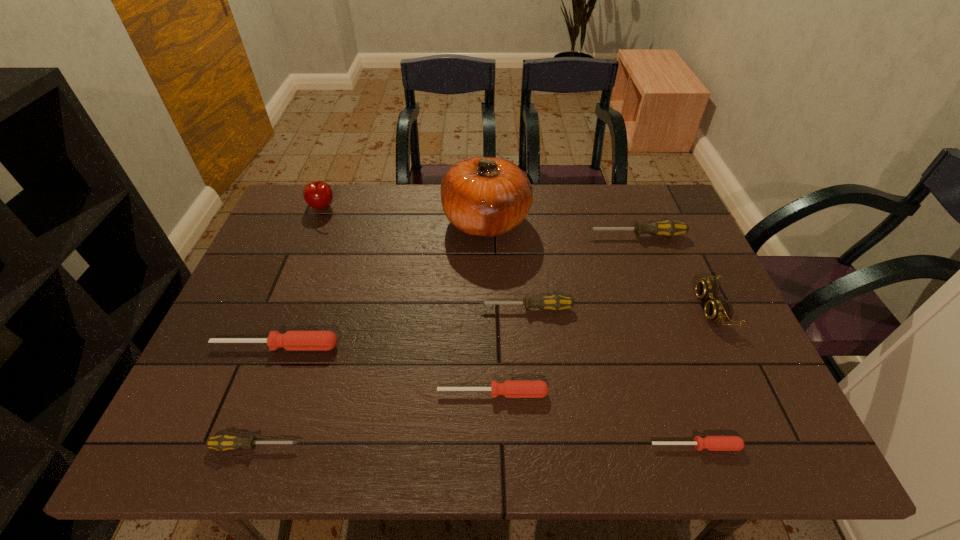
Image resolution: width=960 pixels, height=540 pixels. In order to click on free space that is in between the fourth nearest screwdriver and the smallest gray screwdriver in this screenshot , I will do `click(266, 396)`.

The height and width of the screenshot is (540, 960). What are the coordinates of `vacant area that lies between the second tallest object and the orange pumpkin` in the screenshot? It's located at (405, 214).

Image resolution: width=960 pixels, height=540 pixels. In order to click on free space between the second tallest object and the second farthest screwdriver in this screenshot , I will do `click(425, 258)`.

Locate an element on the screen. This screenshot has width=960, height=540. free spot between the pumpkin and the eighth shortest object is located at coordinates (405, 214).

Identify the location of vacant area between the cherry and the second biggest red screwdriver. (408, 300).

The height and width of the screenshot is (540, 960). I want to click on vacant region between the goggles and the orange pumpkin, so click(x=599, y=264).

At what (x,y) coordinates should I click in order to perform the action: click on free space between the sixth farthest object and the third nearest object. Please return your answer as a coordinate pair (x, y). Image resolution: width=960 pixels, height=540 pixels. Looking at the image, I should click on click(x=384, y=369).

Locate which object is the seventh closest to the second tallest object. Please provide its 2D coordinates. Your answer should be formatted as a tuple, i.e. [(x, y)], where the tuple contains the x and y coordinates of a point satisfying the conditions above.

[(719, 310)]

This screenshot has height=540, width=960. What are the coordinates of `object that can be found as the fourth closest to the goggles` in the screenshot? It's located at (481, 196).

Locate an element on the screen. This screenshot has width=960, height=540. screwdriver that can be found as the closest to the second farthest red screwdriver is located at coordinates (555, 302).